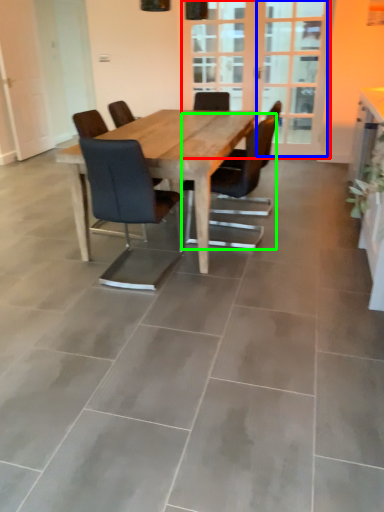
Question: Which object is positioned farthest from screen door (highlighted by a red box)? Select from screen door (highlighted by a blue box) and chair (highlighted by a green box).

Choices:
 (A) screen door
 (B) chair

Answer: (B)